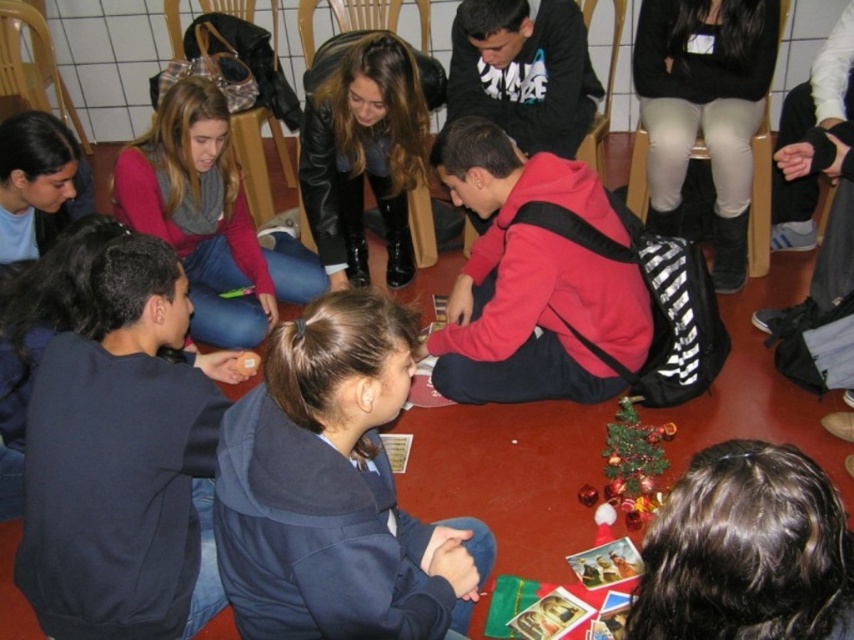
Does dark blue hoodie at center have a lesser height compared to dark brown hair at lower right?

Incorrect, dark blue hoodie at center's height does not fall short of dark brown hair at lower right's.

Which is below, dark blue hoodie at center or dark brown hair at lower right?

dark blue hoodie at center is lower down.

Who is more distant from viewer, (404,611) or (851,614)?

The point (404,611) is more distant.

Where is `dark blue hoodie at center`? dark blue hoodie at center is located at coordinates (332, 490).

How much distance is there between matte red sweater at center and leather jacket at center?

matte red sweater at center and leather jacket at center are 15.13 inches apart from each other.

The width and height of the screenshot is (854, 640). What are the coordinates of `matte red sweater at center` in the screenshot? It's located at (209, 218).

Locate an element on the screen. Image resolution: width=854 pixels, height=640 pixels. matte red sweater at center is located at coordinates (209, 218).

You are a GUI agent. You are given a task and a screenshot of the screen. Output one action in this format:
    pyautogui.click(x=<x>, y=<y>)
    Task: Click on the matte red sweater at center
    
    Given the screenshot: What is the action you would take?
    pyautogui.click(x=209, y=218)

Does point (326, 438) lie in front of point (392, 74)?

Yes, point (326, 438) is in front of point (392, 74).

Can you confirm if dark blue hoodie at center is shorter than leather jacket at center?

Yes, dark blue hoodie at center is shorter than leather jacket at center.

Which is behind, point (352, 387) or point (366, 45)?

The point (366, 45) is behind.

Where is `dark blue hoodie at center`? This screenshot has height=640, width=854. dark blue hoodie at center is located at coordinates (332, 490).